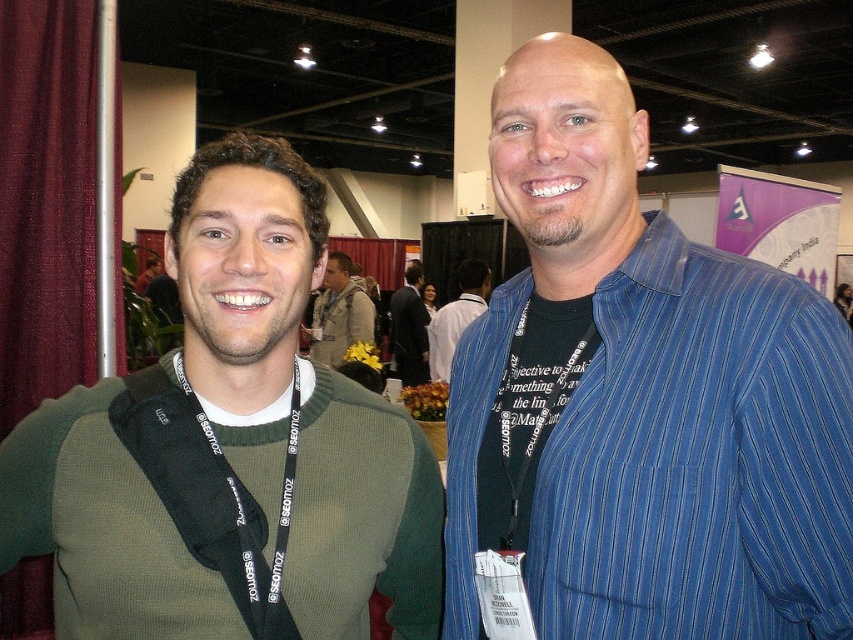
You are standing in the convention hall and see the blue striped shirt at center. If you want to take a photo of it with your phone, which has a minimum focus distance of 12 inches, will you need to move closer or farther away?

The blue striped shirt at center is 30.30 inches away from you. Since your phone requires a minimum focus distance of 12 inches, you do not need to move closer. You can take the photo from your current position.

You are at a convention and need to find the person wearing the dark blue shirt at center. Which direction should you look relative to the green sweater at center?

The dark blue shirt at center is to the right of the green sweater at center, so you should look to the right of the green sweater at center to find the person wearing the dark blue shirt at center.